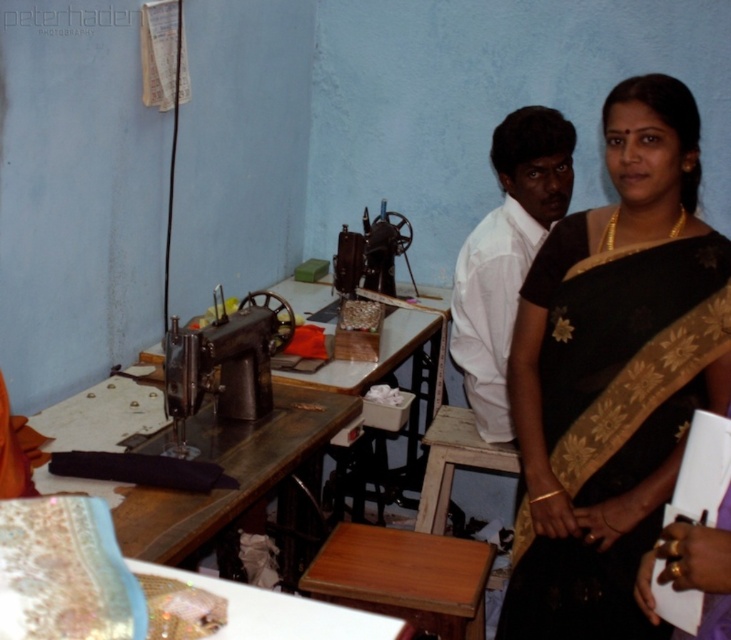
Who is more forward, (249, 460) or (167, 356)?

Positioned in front is point (167, 356).

Can you confirm if wooden table at center is taller than metallic sewing machine at center?

No, wooden table at center is not taller than metallic sewing machine at center.

The width and height of the screenshot is (731, 640). Find the location of `wooden table at center`. wooden table at center is located at coordinates (224, 470).

Between point (645, 240) and point (181, 337), which one is positioned behind?

The point (181, 337) is behind.

You are a GUI agent. You are given a task and a screenshot of the screen. Output one action in this format:
    pyautogui.click(x=<x>, y=<y>)
    Task: Click on the black silk saree at right
    The width and height of the screenshot is (731, 640).
    Given the screenshot: What is the action you would take?
    pyautogui.click(x=613, y=372)

Which is above, black silk saree at right or wooden table at center?

black silk saree at right is above.

What do you see at coordinates (613, 372) in the screenshot? I see `black silk saree at right` at bounding box center [613, 372].

Who is more distant from viewer, (651, 330) or (243, 474)?

Point (243, 474)

What are the coordinates of `black silk saree at right` in the screenshot? It's located at coord(613,372).